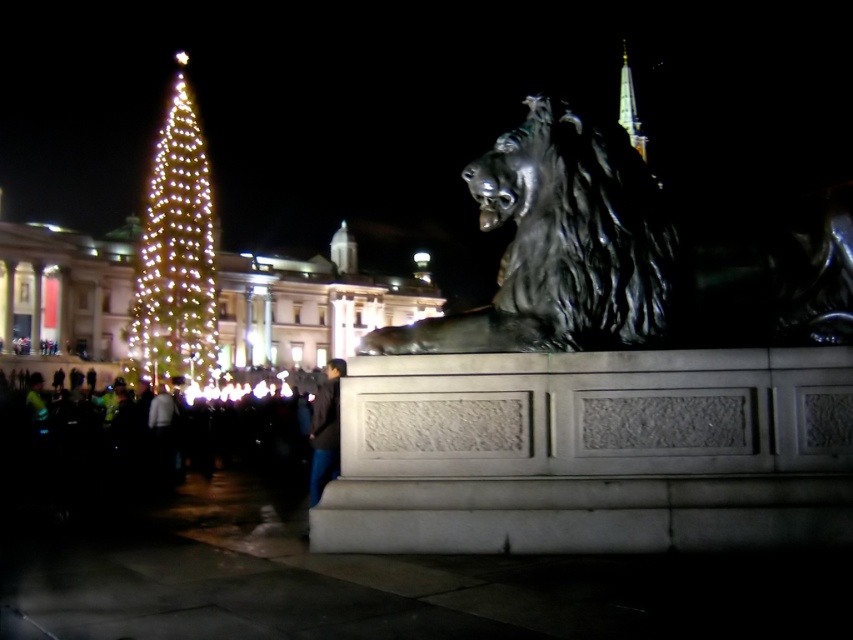
Is point (457, 340) in front of point (323, 381)?

Yes, it is.

How far apart are polished bronze lion at center and dark gray jacket at lower center?

polished bronze lion at center and dark gray jacket at lower center are 10.66 meters apart from each other.

Which is behind, point (524, 300) or point (323, 394)?

The point (323, 394) is more distant.

What are the coordinates of `polished bronze lion at center` in the screenshot? It's located at (560, 244).

Does illuminated glass christmas tree at left have a lesser height compared to dark gray jacket at lower center?

Incorrect, illuminated glass christmas tree at left's height does not fall short of dark gray jacket at lower center's.

Is point (163, 145) behind point (323, 390)?

That is True.

Find the location of a particular element. Image resolution: width=853 pixels, height=640 pixels. illuminated glass christmas tree at left is located at coordinates (175, 257).

Who is lower down, polished bronze lion at center or illuminated glass christmas tree at left?

polished bronze lion at center is below.

Can you confirm if polished bronze lion at center is positioned to the right of illuminated glass christmas tree at left?

Correct, you'll find polished bronze lion at center to the right of illuminated glass christmas tree at left.

Between point (566, 140) and point (175, 177), which one is positioned behind?

Positioned behind is point (175, 177).

I want to click on polished bronze lion at center, so click(x=560, y=244).